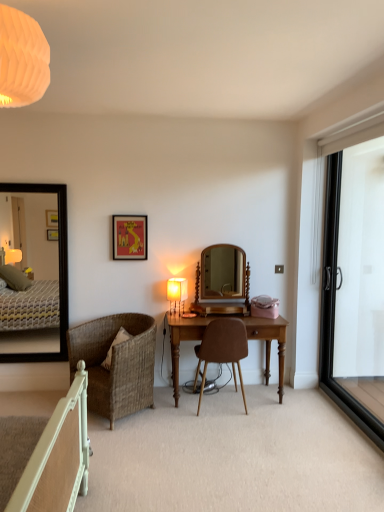
Locate an element on the screen. The width and height of the screenshot is (384, 512). free spot in front of woven rattan chair at lower left, the first chair viewed from the left is located at coordinates (135, 438).